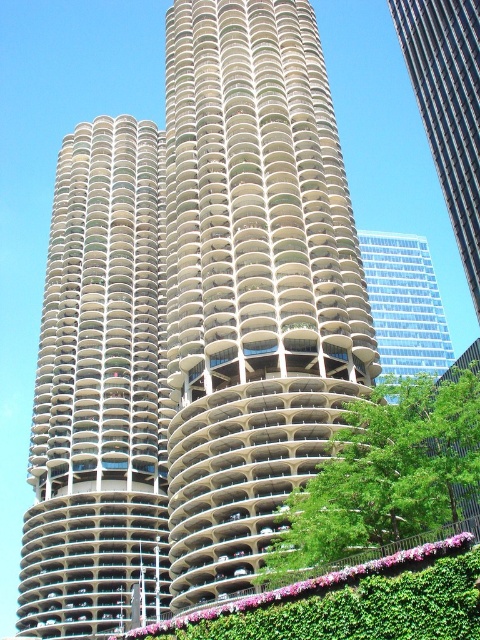
Question: Which of the following is the closest to the observer?

Choices:
 (A) (48, 540)
 (B) (445, 333)

Answer: (A)

Question: In this image, where is glassy reflective skyscraper at upper right located relative to transparent glass skyscraper at upper right?

Choices:
 (A) below
 (B) above

Answer: (B)

Question: Can you confirm if beige concrete tower at center is positioned below transparent glass skyscraper at upper right?

Choices:
 (A) no
 (B) yes

Answer: (A)

Question: Which point appears farthest from the camera in this image?

Choices:
 (A) (436, 301)
 (B) (459, 452)
 (C) (477, 38)

Answer: (A)

Question: Which point is closer to the camera?

Choices:
 (A) transparent glass skyscraper at upper right
 (B) glassy reflective skyscraper at upper right
 (C) beige concrete building at center

Answer: (C)

Question: Does beige concrete building at center have a greater width compared to beige concrete tower at center?

Choices:
 (A) yes
 (B) no

Answer: (A)